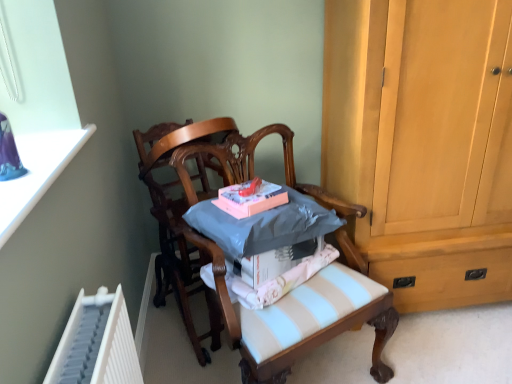
Question: Is light blue striped fabric at center shorter than wooden chair at center, the 2th chair viewed from the left?

Choices:
 (A) no
 (B) yes

Answer: (B)

Question: Is the position of light blue striped fabric at center less distant than that of wooden chair at center, the 2th chair viewed from the left?

Choices:
 (A) no
 (B) yes

Answer: (A)

Question: Is light blue striped fabric at center at the left side of wooden chair at center, the 2th chair viewed from the left?

Choices:
 (A) no
 (B) yes

Answer: (B)

Question: Does light blue striped fabric at center have a lesser width compared to wooden chair at center, the 2th chair viewed from the left?

Choices:
 (A) yes
 (B) no

Answer: (A)

Question: From the image's perspective, would you say light blue striped fabric at center is shown under wooden chair at center, marked as the 1th chair in a right-to-left arrangement?

Choices:
 (A) no
 (B) yes

Answer: (A)

Question: Is light blue striped fabric at center inside the boundaries of wooden chair at center, marked as the 1th chair in a right-to-left arrangement, or outside?

Choices:
 (A) inside
 (B) outside

Answer: (A)

Question: From the image's perspective, relative to wooden chair at center, the 2th chair viewed from the left, is light blue striped fabric at center above or below?

Choices:
 (A) above
 (B) below

Answer: (A)

Question: Is light blue striped fabric at center bigger or smaller than wooden chair at center, the 2th chair viewed from the left?

Choices:
 (A) small
 (B) big

Answer: (A)

Question: From their relative heights in the image, would you say light blue striped fabric at center is taller or shorter than wooden chair at center, marked as the 1th chair in a right-to-left arrangement?

Choices:
 (A) tall
 (B) short

Answer: (B)

Question: Do you think wooden chair at center, the 1th chair in the left-to-right sequence, is within pink matte book at center, or outside of it?

Choices:
 (A) inside
 (B) outside

Answer: (B)

Question: Considering the positions of wooden chair at center, the 1th chair in the left-to-right sequence, and pink matte book at center in the image, is wooden chair at center, the 1th chair in the left-to-right sequence, taller or shorter than pink matte book at center?

Choices:
 (A) short
 (B) tall

Answer: (B)

Question: Would you say wooden chair at center, the 1th chair in the left-to-right sequence, is to the left or to the right of pink matte book at center in the picture?

Choices:
 (A) left
 (B) right

Answer: (A)

Question: From a real-world perspective, is wooden chair at center, the 1th chair in the left-to-right sequence, above or below pink matte book at center?

Choices:
 (A) below
 (B) above

Answer: (A)

Question: Based on their positions, is pink matte book at center located to the left or right of light brown wood cabinet at right?

Choices:
 (A) left
 (B) right

Answer: (A)

Question: From the image's perspective, is pink matte book at center above or below light brown wood cabinet at right?

Choices:
 (A) above
 (B) below

Answer: (B)